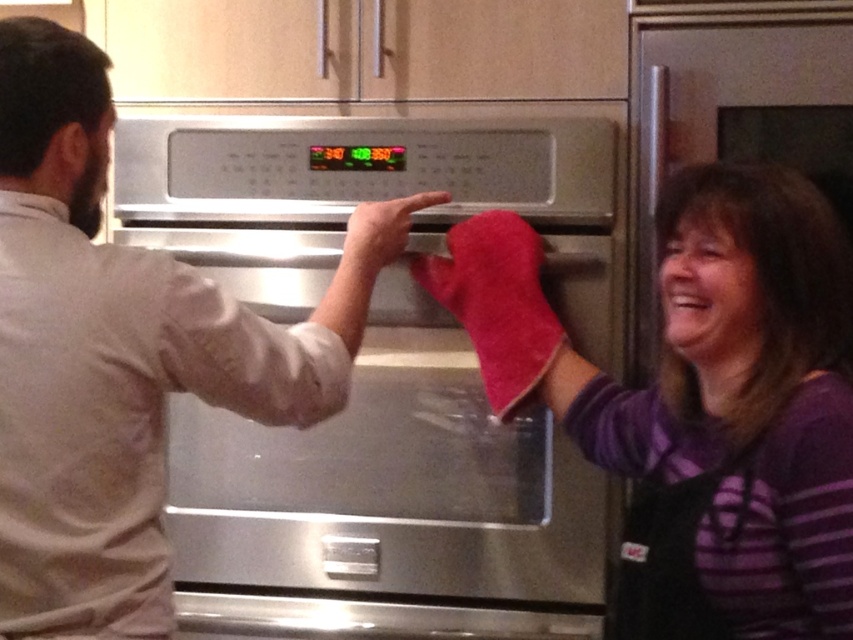
Question: Which object is the closest to the red cotton oven mitt at center?

Choices:
 (A) stainless steel oven at center
 (B) matte white shirt at left

Answer: (A)

Question: Among these objects, which one is farthest from the camera?

Choices:
 (A) stainless steel oven at center
 (B) red cotton oven mitt at center

Answer: (A)

Question: Which point is farther from the camera taking this photo?

Choices:
 (A) (663, 636)
 (B) (86, 324)

Answer: (A)

Question: Where is stainless steel oven at center located in relation to red cotton oven mitt at center in the image?

Choices:
 (A) left
 (B) right

Answer: (A)

Question: Is stainless steel oven at center thinner than matte white shirt at left?

Choices:
 (A) yes
 (B) no

Answer: (B)

Question: Is stainless steel oven at center positioned in front of red cotton oven mitt at center?

Choices:
 (A) yes
 (B) no

Answer: (B)